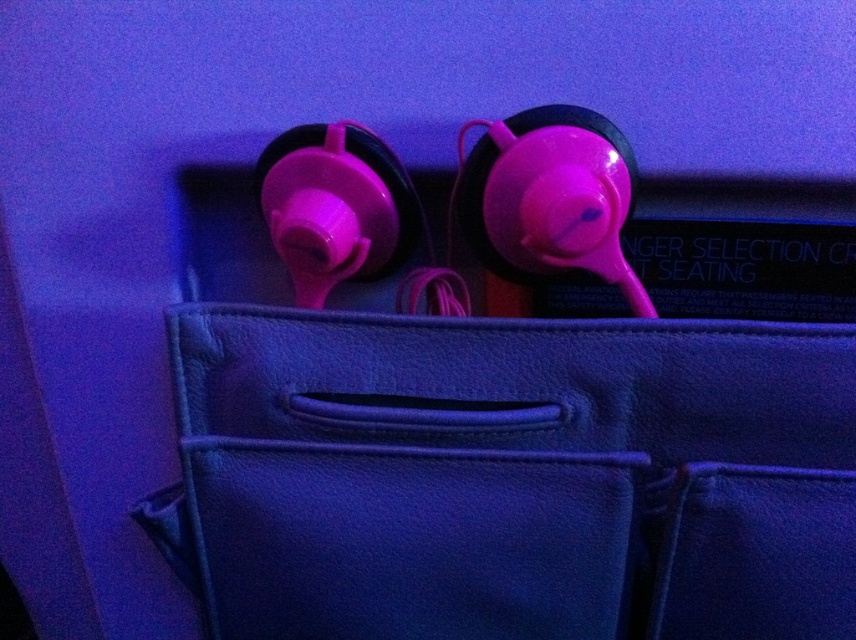
Question: Which point is closer to the camera?

Choices:
 (A) leather bag at center
 (B) matte pink earphone at upper center
 (C) pink matte earphone at center

Answer: (C)

Question: Which is farther from the matte pink earphone at upper center?

Choices:
 (A) leather bag at center
 (B) pink matte earphone at center

Answer: (A)

Question: Can you confirm if pink matte earphone at center is bigger than matte pink earphone at upper center?

Choices:
 (A) no
 (B) yes

Answer: (B)

Question: Can you confirm if leather bag at center is wider than matte pink earphone at upper center?

Choices:
 (A) yes
 (B) no

Answer: (A)

Question: Among these objects, which one is farthest from the camera?

Choices:
 (A) leather bag at center
 (B) pink matte earphone at center
 (C) matte pink earphone at upper center

Answer: (C)

Question: Does pink matte earphone at center lie in front of matte pink earphone at upper center?

Choices:
 (A) no
 (B) yes

Answer: (B)